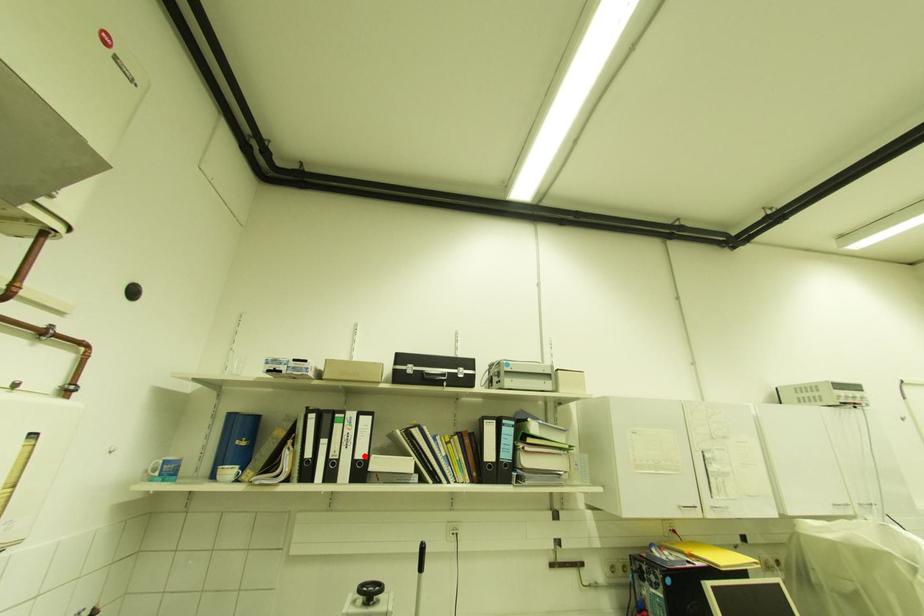
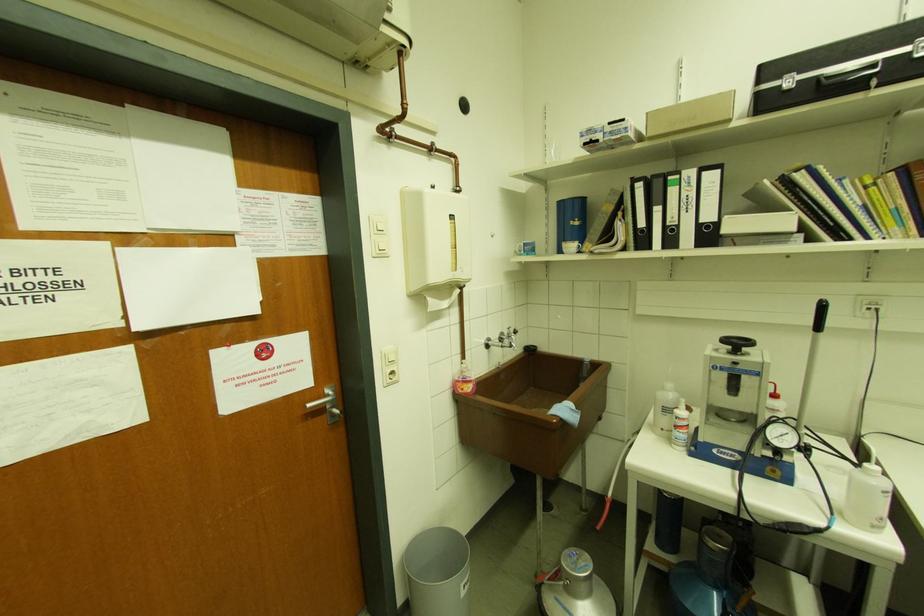
Question: I am providing you with two images of the same scene from different viewpoints. A red point is marked on the first image. Can you still see the location of the red point in image 2?

Choices:
 (A) Yes
 (B) No

Answer: (A)